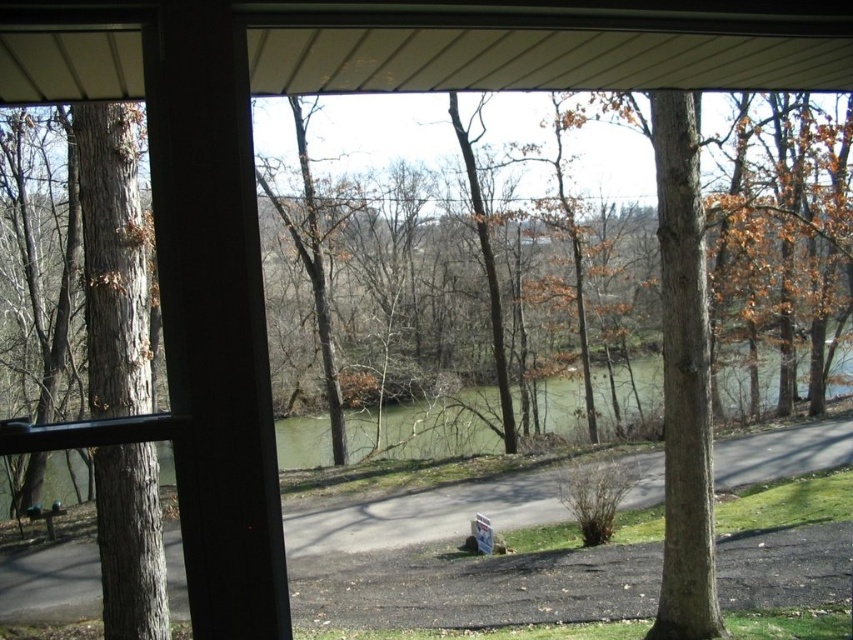
Can you confirm if gray bark tree at left is shorter than green grassy lake at center?

Correct, gray bark tree at left is not as tall as green grassy lake at center.

The image size is (853, 640). In order to click on gray bark tree at left in this screenshot , I will do `click(113, 260)`.

The image size is (853, 640). In order to click on gray bark tree at left in this screenshot , I will do `click(113, 260)`.

Can you confirm if gray bark tree at left is wider than wooden park bench at lower left?

Incorrect, gray bark tree at left's width does not surpass wooden park bench at lower left's.

Is gray bark tree at left taller than wooden park bench at lower left?

Correct, gray bark tree at left is much taller as wooden park bench at lower left.

The height and width of the screenshot is (640, 853). In order to click on gray bark tree at left in this screenshot , I will do `click(113, 260)`.

Does green grassy lake at center have a lesser width compared to wooden park bench at lower left?

No, green grassy lake at center is not thinner than wooden park bench at lower left.

At what (x,y) coordinates should I click in order to perform the action: click on green grassy lake at center. Please return your answer as a coordinate pair (x, y). Image resolution: width=853 pixels, height=640 pixels. Looking at the image, I should click on (392, 445).

Describe the element at coordinates (392, 445) in the screenshot. This screenshot has width=853, height=640. I see `green grassy lake at center` at that location.

Where is `green grassy lake at center`? The image size is (853, 640). green grassy lake at center is located at coordinates (392, 445).